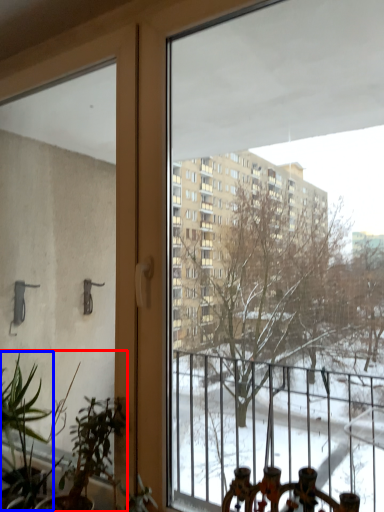
Question: Which object appears farthest to the camera in this image, houseplant (highlighted by a red box) or plant (highlighted by a blue box)?

Choices:
 (A) houseplant
 (B) plant

Answer: (B)